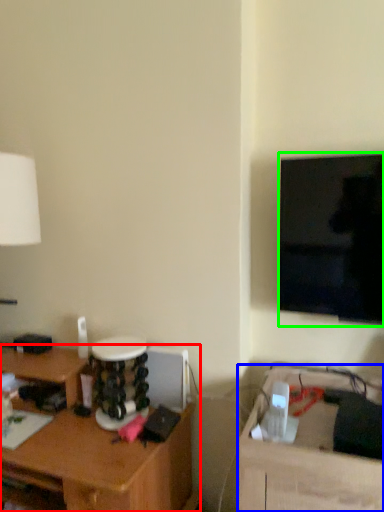
Question: Based on their relative distances, which object is nearer to desk (highlighted by a red box)? Choose from table (highlighted by a blue box) and television (highlighted by a green box).

Choices:
 (A) table
 (B) television

Answer: (A)